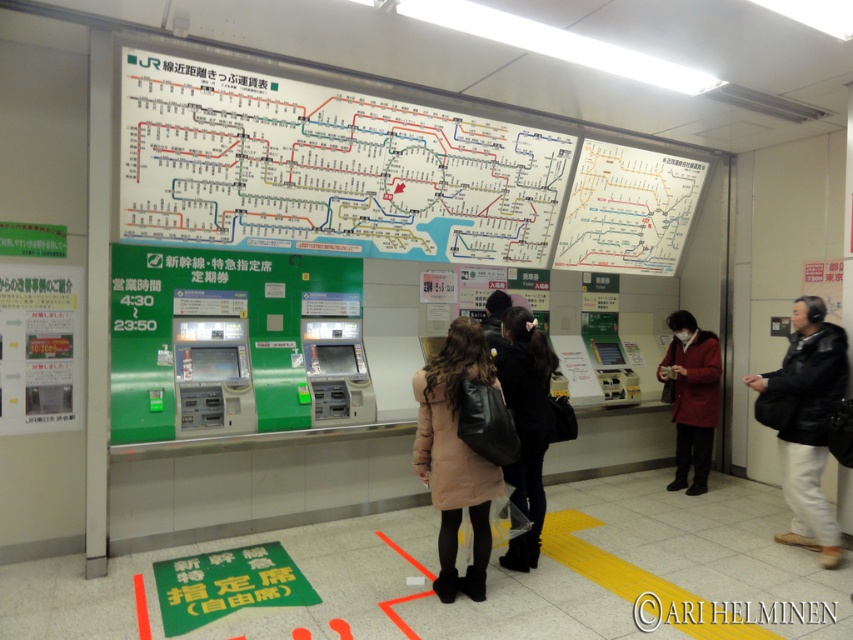
Which is in front, point (694, 163) or point (788, 536)?

Point (788, 536) is more forward.

Does white paper map at upper right appear on the right side of black leather jacket at right?

No, white paper map at upper right is not to the right of black leather jacket at right.

Image resolution: width=853 pixels, height=640 pixels. What are the coordinates of `white paper map at upper right` in the screenshot? It's located at (627, 209).

Between white paper map at upper right and matte black jacket at center, which one has less height?

Standing shorter between the two is matte black jacket at center.

Consider the image. Does white paper map at upper right have a greater height compared to matte black jacket at center?

Correct, white paper map at upper right is much taller as matte black jacket at center.

At what (x,y) coordinates should I click in order to perform the action: click on white paper map at upper right. Please return your answer as a coordinate pair (x, y). Image resolution: width=853 pixels, height=640 pixels. Looking at the image, I should click on (627, 209).

I want to click on white paper map at upper right, so click(x=627, y=209).

Does white paper map at upper right appear on the left side of beige wool coat at center?

In fact, white paper map at upper right is to the right of beige wool coat at center.

Can you confirm if white paper map at upper right is positioned above beige wool coat at center?

Correct, white paper map at upper right is located above beige wool coat at center.

Does point (608, 202) lie in front of point (479, 525)?

No, (608, 202) is behind (479, 525).

Find the location of a particular element. Image resolution: width=853 pixels, height=640 pixels. white paper map at upper right is located at coordinates (627, 209).